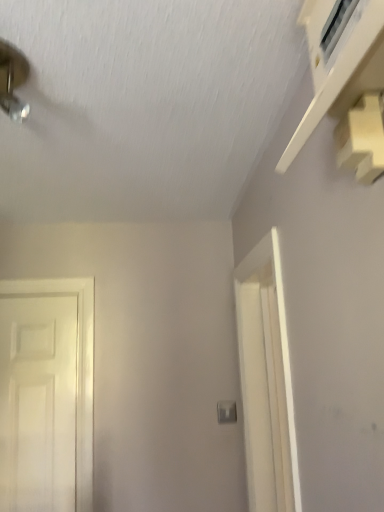
Question: From a real-world perspective, is white matte door at left positioned under white plastic light switch at center based on gravity?

Choices:
 (A) no
 (B) yes

Answer: (A)

Question: Is white matte door at left directly adjacent to white plastic light switch at center?

Choices:
 (A) no
 (B) yes

Answer: (A)

Question: Does white matte door at left have a greater height compared to white plastic light switch at center?

Choices:
 (A) yes
 (B) no

Answer: (A)

Question: Is white matte door at left not close to white plastic light switch at center?

Choices:
 (A) yes
 (B) no

Answer: (B)

Question: Is white matte door at left oriented towards white plastic light switch at center?

Choices:
 (A) no
 (B) yes

Answer: (A)

Question: Is white matte door at left not inside white plastic light switch at center?

Choices:
 (A) yes
 (B) no

Answer: (A)

Question: Is white plastic light switch at center aimed at white matte door at left?

Choices:
 (A) no
 (B) yes

Answer: (A)

Question: Is white plastic light switch at center behind white matte door at left?

Choices:
 (A) yes
 (B) no

Answer: (A)

Question: Is white plastic light switch at center looking in the opposite direction of white matte door at left?

Choices:
 (A) yes
 (B) no

Answer: (B)

Question: Does white plastic light switch at center have a smaller size compared to white matte door at left?

Choices:
 (A) yes
 (B) no

Answer: (A)

Question: Is white plastic light switch at center not close to white matte door at left?

Choices:
 (A) yes
 (B) no

Answer: (B)

Question: Can you confirm if white plastic light switch at center is shorter than white matte door at left?

Choices:
 (A) yes
 (B) no

Answer: (A)

Question: Considering the positions of point (13, 317) and point (226, 416), is point (13, 317) closer or farther from the camera than point (226, 416)?

Choices:
 (A) closer
 (B) farther

Answer: (B)